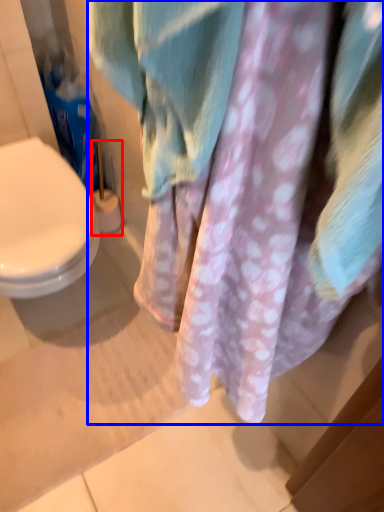
Question: Which point is further to the camera, brush (highlighted by a red box) or laundry (highlighted by a blue box)?

Choices:
 (A) brush
 (B) laundry

Answer: (A)